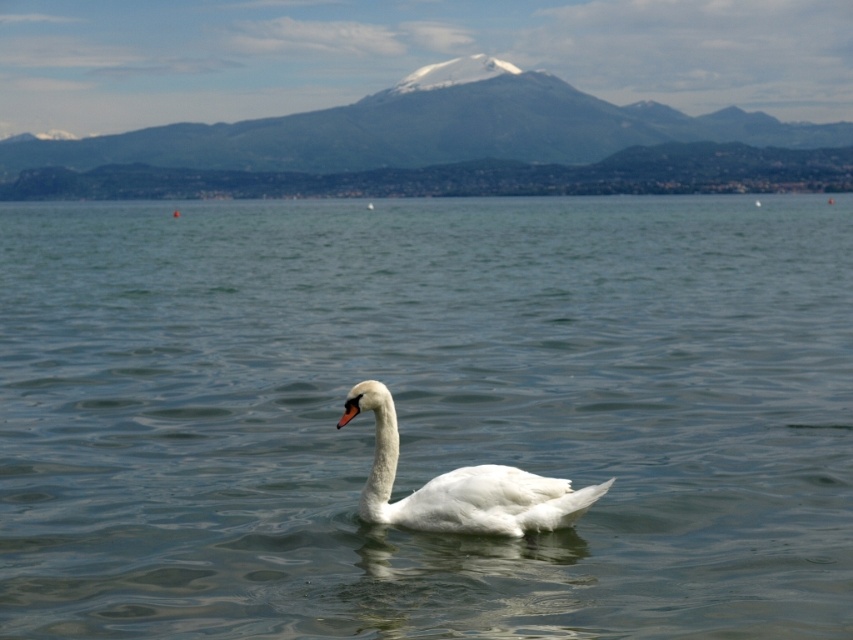
Who is positioned more to the left, snow-covered mountain at upper center or white matte swan at center?

Positioned to the left is snow-covered mountain at upper center.

Which is above, snow-covered mountain at upper center or white matte swan at center?

Positioned higher is snow-covered mountain at upper center.

Measure the distance between snow-covered mountain at upper center and camera.

snow-covered mountain at upper center is 88.12 meters from camera.

This screenshot has width=853, height=640. What are the coordinates of `snow-covered mountain at upper center` in the screenshot? It's located at (442, 150).

Does clear water at center have a lesser width compared to snow-covered mountain at upper center?

Yes.

Which is above, clear water at center or snow-covered mountain at upper center?

snow-covered mountain at upper center is above.

Describe the element at coordinates (425, 413) in the screenshot. I see `clear water at center` at that location.

At what (x,y) coordinates should I click in order to perform the action: click on clear water at center. Please return your answer as a coordinate pair (x, y). Looking at the image, I should click on (425, 413).

Which is more to the right, clear water at center or white matte swan at center?

white matte swan at center

From the picture: Who is more distant from viewer, (616, 413) or (540, 506)?

The point (616, 413) is more distant.

You are a GUI agent. You are given a task and a screenshot of the screen. Output one action in this format:
    pyautogui.click(x=<x>, y=<y>)
    Task: Click on the clear water at center
    
    Given the screenshot: What is the action you would take?
    pyautogui.click(x=425, y=413)